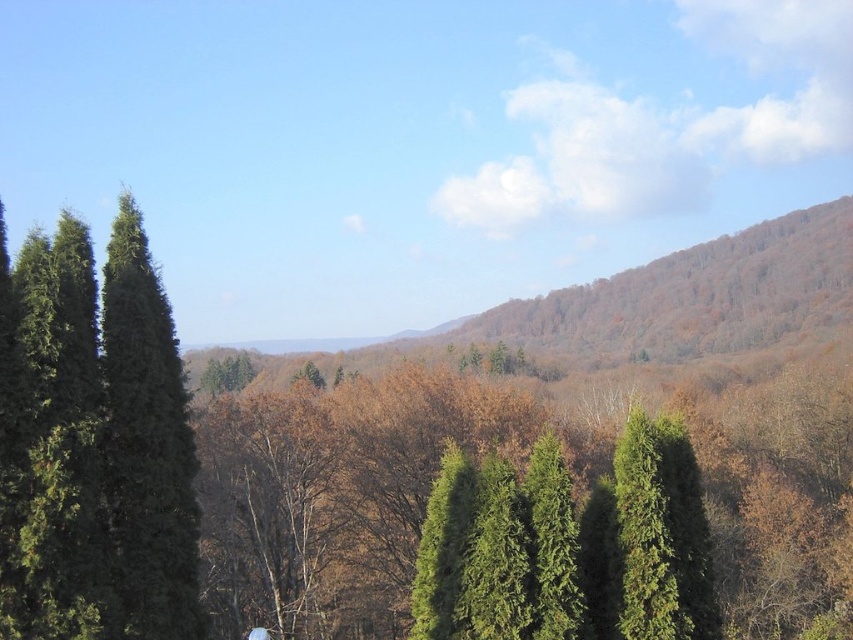
Is green textured trees at center below green matte tree at left?

Indeed, green textured trees at center is positioned under green matte tree at left.

From the picture: Between green textured trees at center and green matte tree at left, which one appears on the right side from the viewer's perspective?

green textured trees at center is more to the right.

Where is `green textured trees at center`? The image size is (853, 640). green textured trees at center is located at coordinates (357, 490).

Locate an element on the screen. green textured trees at center is located at coordinates (357, 490).